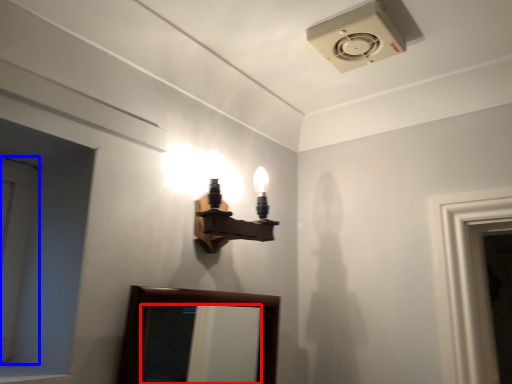
Question: Which point is further to the camera, mirror (highlighted by a red box) or door (highlighted by a blue box)?

Choices:
 (A) mirror
 (B) door

Answer: (A)